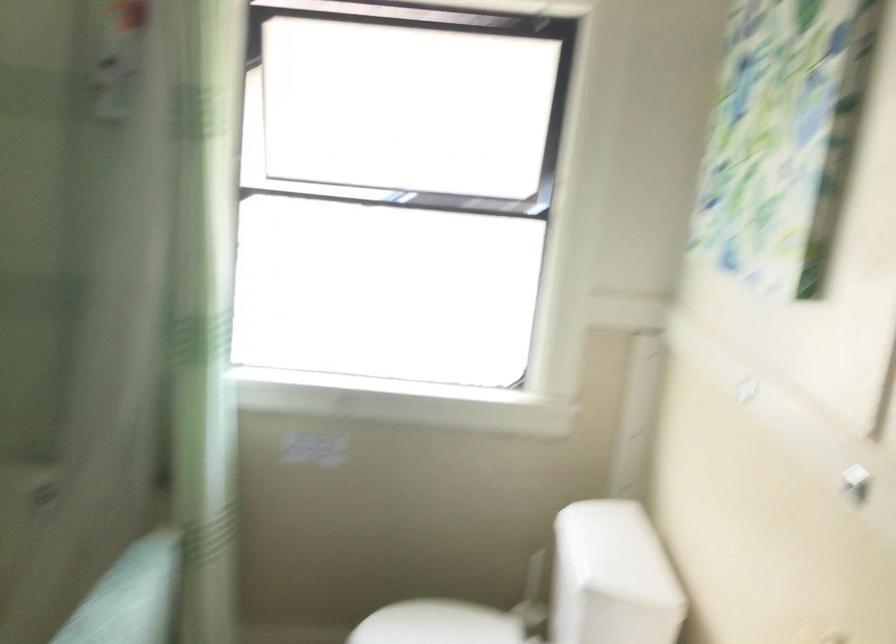
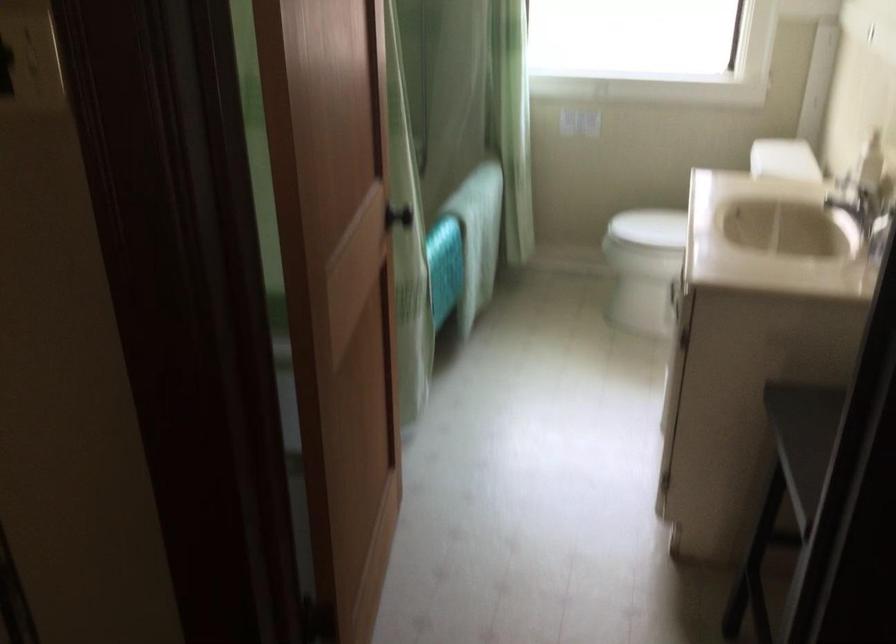
Question: In a continuous first-person perspective shot, in which direction is the camera moving?

Choices:
 (A) Left
 (B) Right
 (C) Forward
 (D) Backward

Answer: (D)